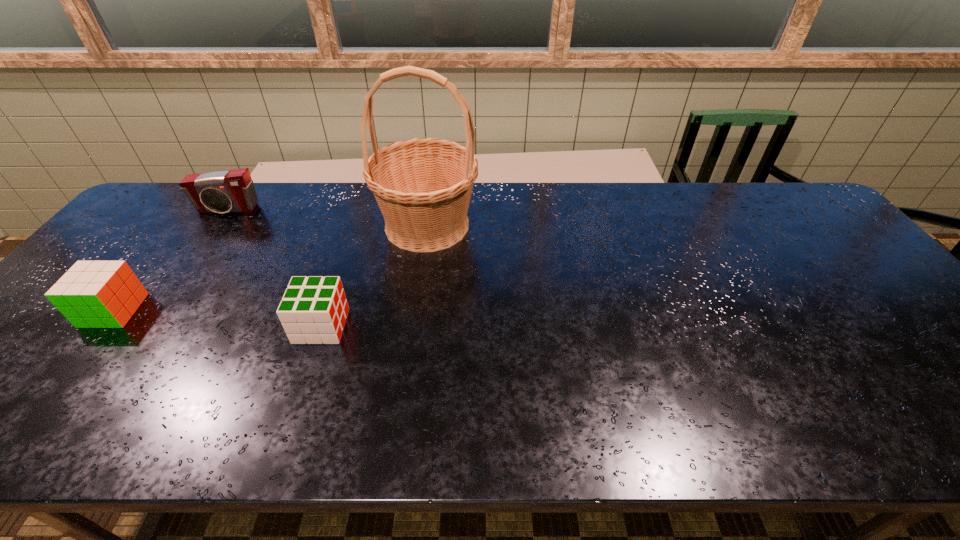
Where is `the rightmost object`? the rightmost object is located at coordinates (423, 186).

What are the coordinates of `basket` in the screenshot? It's located at (423, 186).

Where is `camera`? camera is located at coordinates (229, 191).

I want to click on the left cube, so click(x=93, y=294).

Where is `the right cube`? the right cube is located at coordinates (313, 310).

The width and height of the screenshot is (960, 540). In order to click on free space located 0.170m on the left of the tallest object in this screenshot , I will do `click(321, 225)`.

Image resolution: width=960 pixels, height=540 pixels. Identify the location of free space located on the front-facing side of the camera. click(x=176, y=284).

The width and height of the screenshot is (960, 540). Find the location of `vacant position located 0.390m on the back of the left cube`. vacant position located 0.390m on the back of the left cube is located at coordinates (196, 207).

Identify the location of vacant space situated 0.240m on the red face of the third object from left to right. This screenshot has height=540, width=960. (444, 326).

Where is `basket located at the far edge`? The height and width of the screenshot is (540, 960). basket located at the far edge is located at coordinates (423, 186).